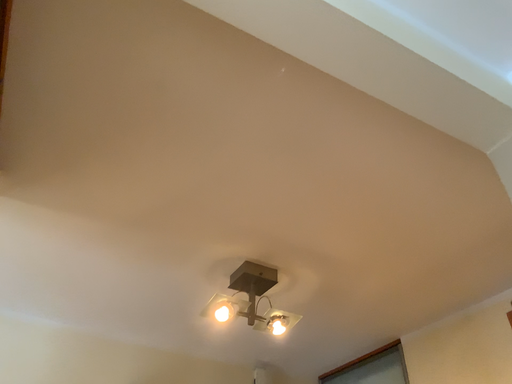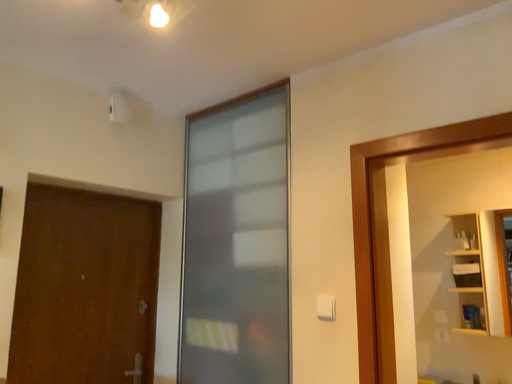
Question: How did the camera likely rotate when shooting the video?

Choices:
 (A) rotated upward
 (B) rotated downward

Answer: (B)